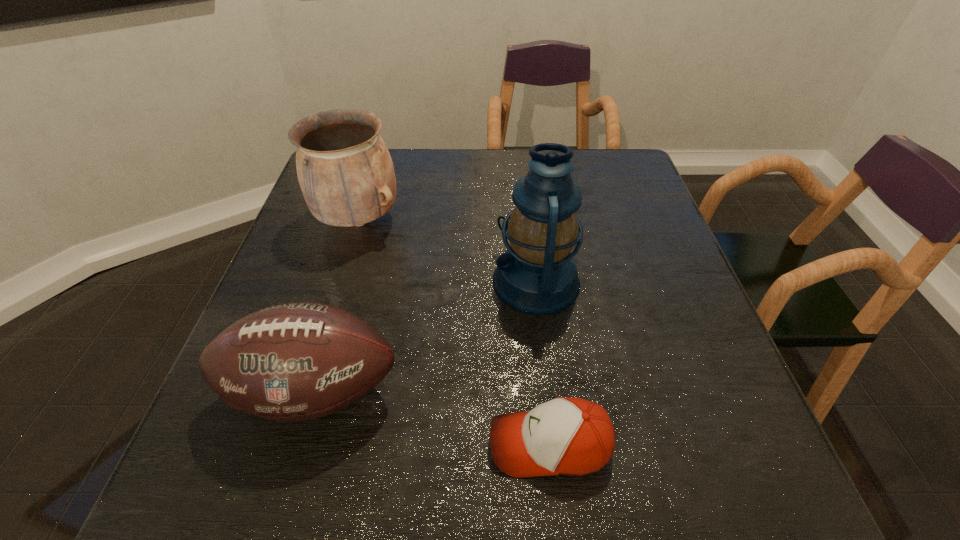
Locate an element on the screen. lantern is located at coordinates (537, 275).

Identify the location of urn. (345, 171).

Where is `the third tallest object`? the third tallest object is located at coordinates (297, 361).

I want to click on the shortest object, so click(566, 436).

Locate an element on the screen. Image resolution: width=960 pixels, height=540 pixels. vacant space located 0.340m on the face of the lantern is located at coordinates (339, 281).

At what (x,y) coordinates should I click in order to perform the action: click on vacant space situated on the face of the lantern. Please return your answer as a coordinate pair (x, y). Looking at the image, I should click on (330, 281).

At what (x,y) coordinates should I click in order to perform the action: click on vacant space situated on the face of the lantern. Please return your answer as a coordinate pair (x, y). The height and width of the screenshot is (540, 960). Looking at the image, I should click on (420, 281).

In order to click on free spot located on the back of the second tallest object in this screenshot , I will do `click(379, 156)`.

The width and height of the screenshot is (960, 540). Identify the location of blank space located on the right of the second shortest object. (619, 392).

This screenshot has width=960, height=540. I want to click on vacant region located 0.210m on the front-facing side of the baseball cap, so click(362, 444).